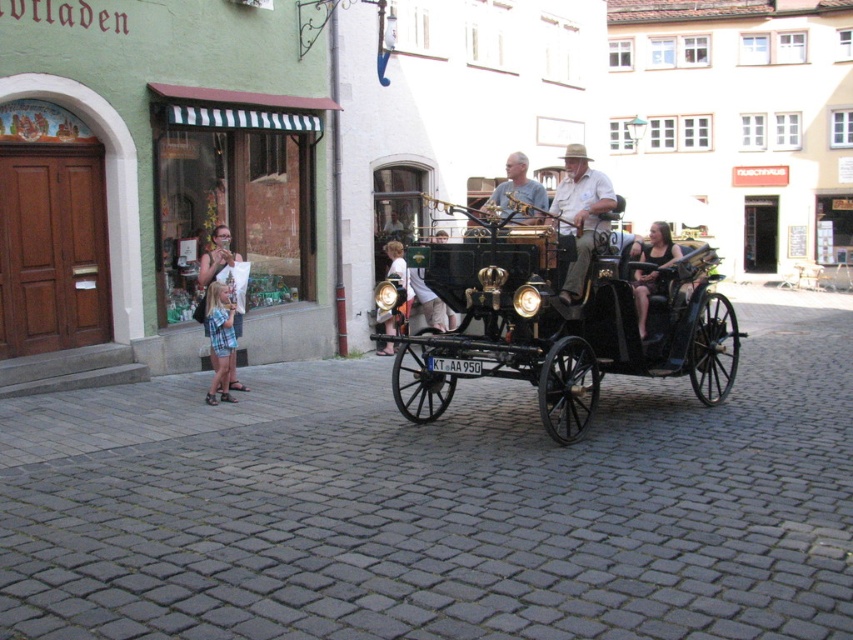
From the picture: You are a tourist standing in the European town square and want to take a photo of the plaid shorts at left. Where should you position yourself to capture the best shot?

To capture the best shot of the plaid shorts at left, position yourself at a point slightly to the right of the plaid shorts at left, ensuring they are centered in your camera frame. Since the plaid shorts at left are located at coordinates (216, 256), this positioning will provide a clear and focused image.

Based on the scene described, which object is shorter between the polished wood horse cart at center and the light brown leather jacket at center?

The polished wood horse cart at center is shorter than the light brown leather jacket at center.